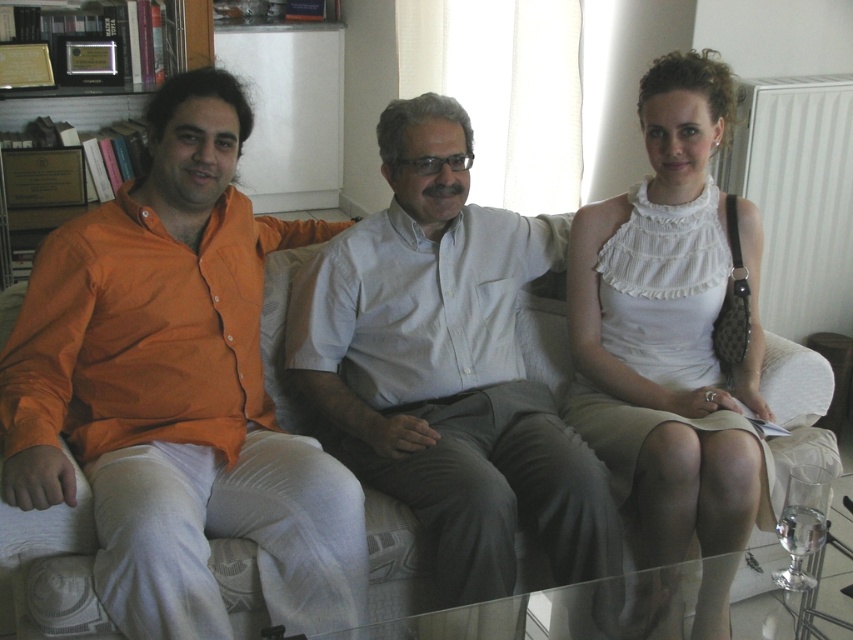
Looking at this image, you are standing in the living room and want to reach a specific point at coordinates point (352, 620). The radiator is on the right side of the image. Can you estimate how far you need to walk to reach that point?

The distance of point (352, 620) from the camera is 5.72 feet, so you need to walk approximately 5.72 feet to reach that point.

You are a photographer setting up a shoot in this living room. You need to position a light source to illuminate the white ruffled blouse at center without casting shadows from the wooden bookshelf at upper left. Where should you place the light source relative to the bookshelf?

The white ruffled blouse at center is below the wooden bookshelf at upper left, so placing the light source above the bookshelf would cast light downward, illuminating the blouse while keeping the bookshelf above it from casting shadows onto the blouse.

You are standing in the living room and need to find the orange cotton shirt at left. According to the coordinates provided, where should you look relative to the radiator?

The orange cotton shirt at left is located at point coordinates closer to the radiator than the center of the room.